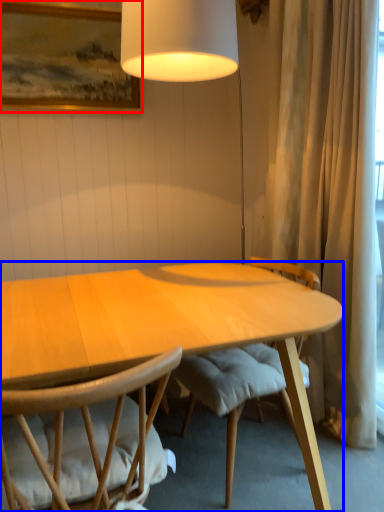
Question: Which of the following is the farthest to the observer, picture frame (highlighted by a red box) or desk (highlighted by a blue box)?

Choices:
 (A) picture frame
 (B) desk

Answer: (A)